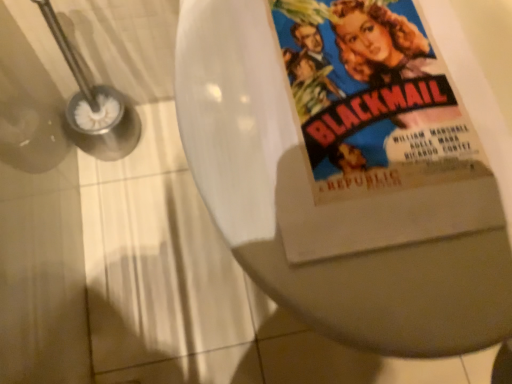
Locate an element on the screen. free space above white glossy toilet seat at upper center (from a real-world perspective) is located at coordinates (371, 114).